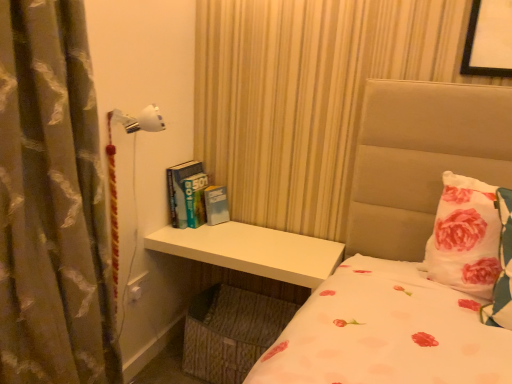
Question: Should I look upward or downward to see white glossy table at lower center?

Choices:
 (A) down
 (B) up

Answer: (A)

Question: Is white floral pillow at right at the right side of hardcover books at center?

Choices:
 (A) yes
 (B) no

Answer: (A)

Question: From a real-world perspective, is white floral pillow at right on top of hardcover books at center?

Choices:
 (A) yes
 (B) no

Answer: (A)

Question: Is white floral pillow at right oriented towards hardcover books at center?

Choices:
 (A) yes
 (B) no

Answer: (B)

Question: Is hardcover books at center located within white floral pillow at right?

Choices:
 (A) yes
 (B) no

Answer: (B)

Question: From the image's perspective, does white floral pillow at right appear lower than hardcover books at center?

Choices:
 (A) yes
 (B) no

Answer: (A)

Question: Is white floral pillow at right outside hardcover books at center?

Choices:
 (A) no
 (B) yes

Answer: (B)

Question: Could you tell me if white floral pillow at right is turned towards white glossy table at lower center?

Choices:
 (A) yes
 (B) no

Answer: (B)

Question: From a real-world perspective, is white floral pillow at right physically above white glossy table at lower center?

Choices:
 (A) yes
 (B) no

Answer: (A)

Question: Does white floral pillow at right have a lesser height compared to white glossy table at lower center?

Choices:
 (A) no
 (B) yes

Answer: (B)

Question: Is white floral pillow at right far away from white glossy table at lower center?

Choices:
 (A) no
 (B) yes

Answer: (A)

Question: Is the position of white floral pillow at right less distant than that of white glossy table at lower center?

Choices:
 (A) no
 (B) yes

Answer: (B)

Question: Is white glossy table at lower center completely or partially inside white floral pillow at right?

Choices:
 (A) yes
 (B) no

Answer: (B)

Question: Is silky brown curtain at left at the back of hardcover books at center?

Choices:
 (A) no
 (B) yes

Answer: (A)